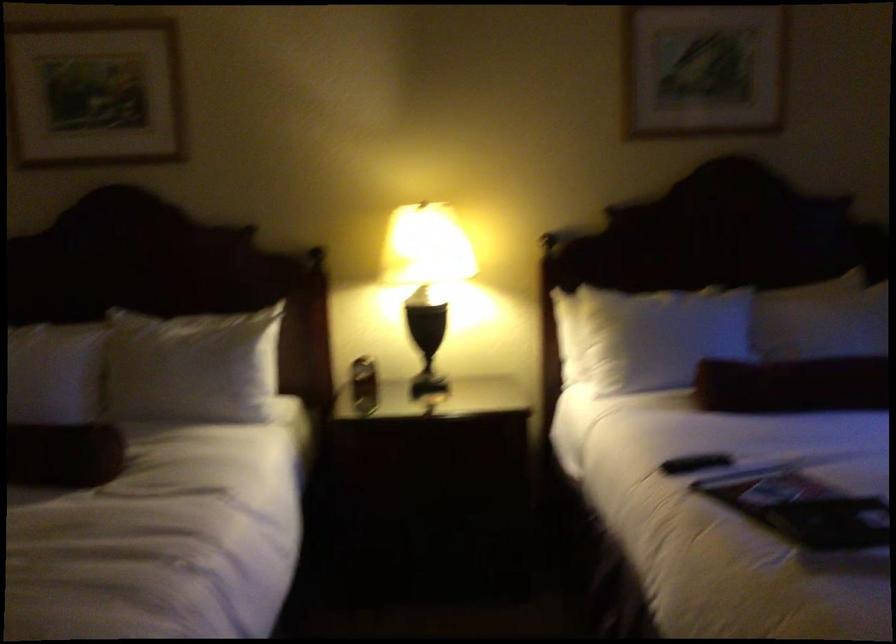
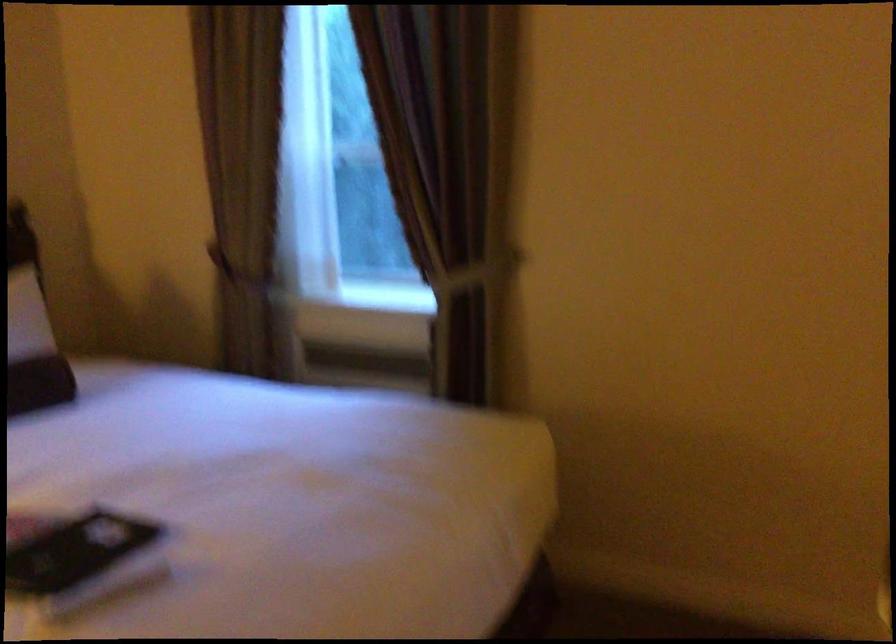
Question: The images are taken continuously from a first-person perspective. In which direction is your viewpoint rotating?

Choices:
 (A) Left
 (B) Right
 (C) Up
 (D) Down

Answer: (B)